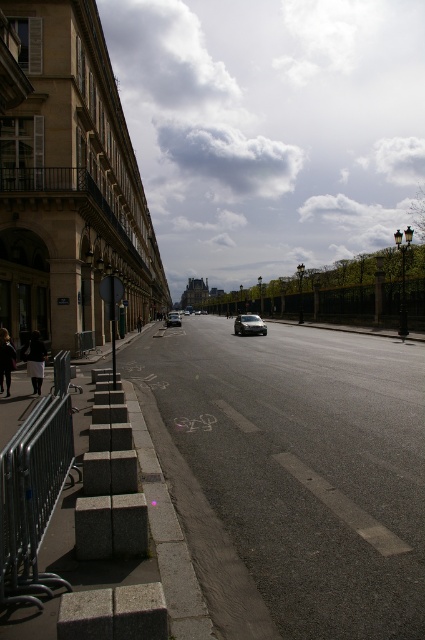
Where is `silver metallic rail at lower left`? This screenshot has width=425, height=640. silver metallic rail at lower left is located at coordinates (33, 497).

Measure the distance between point (51, 504) and camera.

Point (51, 504) and camera are 4.73 meters apart.

Which is behind, point (54, 477) or point (254, 323)?

The point (254, 323) is more distant.

Locate an element on the screen. The height and width of the screenshot is (640, 425). silver metallic rail at lower left is located at coordinates (33, 497).

Does satin black car at center come in front of shiny silver sedan at center?

Yes, it is.

Is point (241, 316) positioned in front of point (170, 317)?

That is True.

Locate an element on the screen. The height and width of the screenshot is (640, 425). satin black car at center is located at coordinates (249, 324).

Who is positioned more to the left, silver metallic rail at lower left or shiny silver sedan at center?

Positioned to the left is shiny silver sedan at center.

Which is below, silver metallic rail at lower left or shiny silver sedan at center?

silver metallic rail at lower left is lower down.

Is point (28, 433) positioned after point (166, 323)?

No, it is in front of (166, 323).

This screenshot has height=640, width=425. Find the location of `silver metallic rail at lower left`. silver metallic rail at lower left is located at coordinates (33, 497).